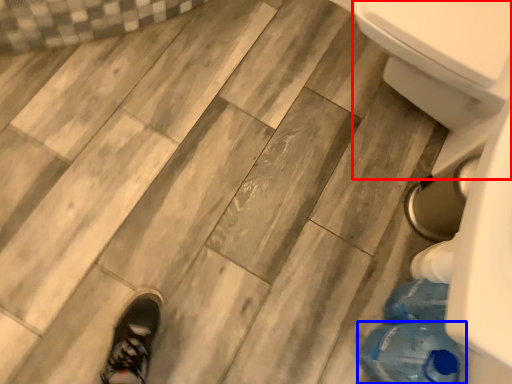
Question: Which object appears closest to the camera in this image, bidet (highlighted by a red box) or bottle (highlighted by a blue box)?

Choices:
 (A) bidet
 (B) bottle

Answer: (B)